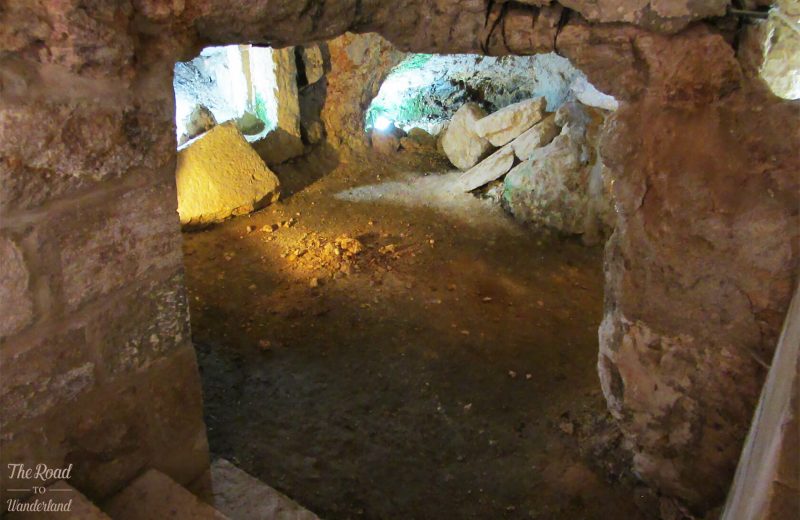
Where is `bottom step`? The height and width of the screenshot is (520, 800). bottom step is located at coordinates (273, 508).